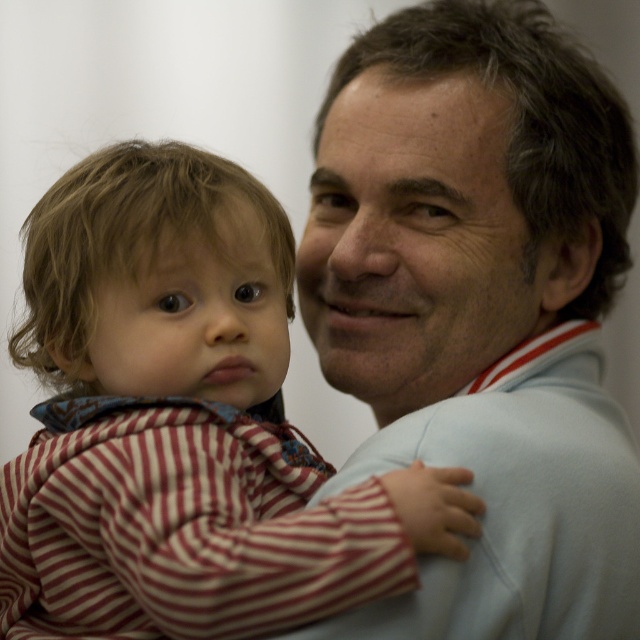
Is point (540, 624) less distant than point (243, 348)?

Yes, it is in front of point (243, 348).

Identify the location of light blue sweater at upper right. (481, 307).

Is point (593, 451) behind point (156, 452)?

Yes.

Where is `light blue sweater at upper right`? light blue sweater at upper right is located at coordinates (481, 307).